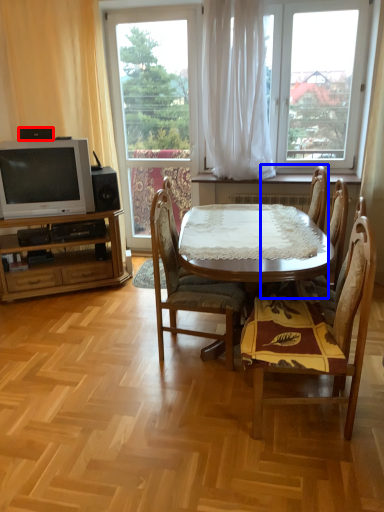
Question: Which point is closer to the camera, loudspeaker (highlighted by a red box) or chair (highlighted by a blue box)?

Choices:
 (A) loudspeaker
 (B) chair

Answer: (B)